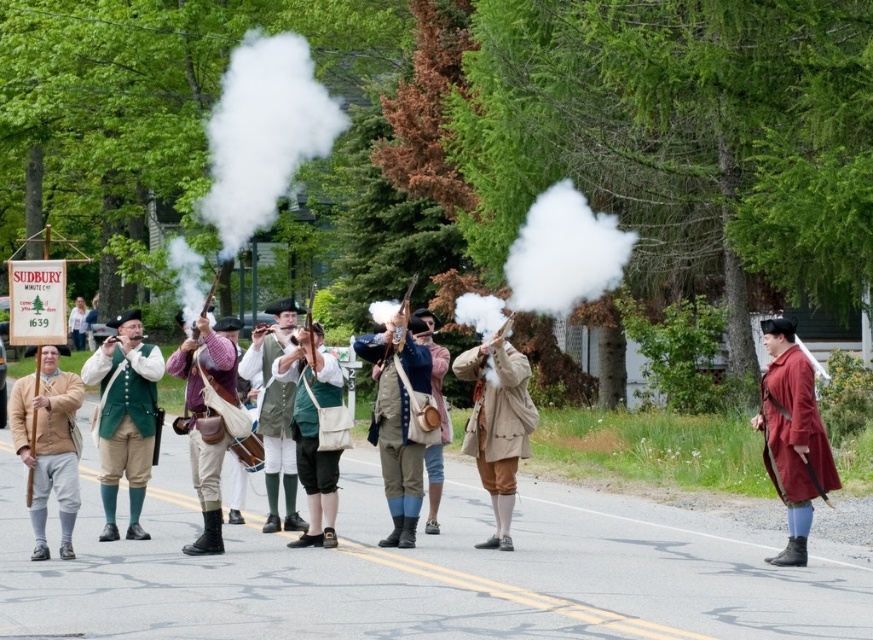
From the picture: You are a photographer at the historical reenactment scene. You want to capture a shot where the white smoke at center and the light brown leather coat at center are both visible. Which object will appear larger in your photo?

The white smoke at center will appear larger in the photo because it is bigger than the light brown leather coat at center.

You are a costume designer preparing for a historical play. You need to arrange two coats on a mannequin for a scene where they must be close enough to appear as part of the same ensemble but not overlapping. Given the space between the light brown leather coat at center and the green wool coat at center, is the distance sufficient to avoid overlapping while maintaining visual cohesion?

The light brown leather coat at center and green wool coat at center are 34.73 inches apart, which is a sufficient distance to prevent overlapping while still allowing them to appear as part of the same ensemble in the scene.